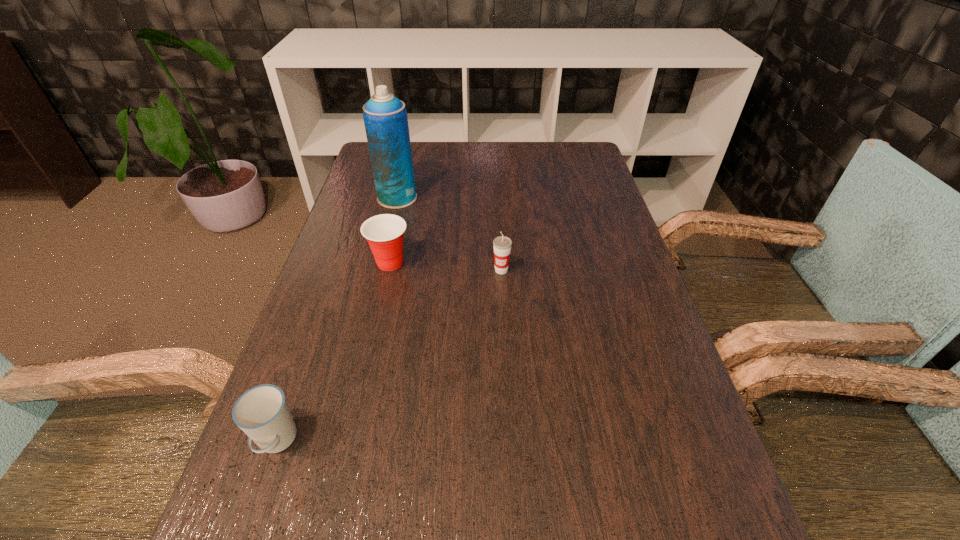
You are a GUI agent. You are given a task and a screenshot of the screen. Output one action in this format:
    pyautogui.click(x=<x>, y=<y>)
    Task: Click on the tallest object
    
    Given the screenshot: What is the action you would take?
    pyautogui.click(x=385, y=118)

Where is `the farthest object`? The image size is (960, 540). the farthest object is located at coordinates (385, 118).

Locate an element on the screen. the rightmost cup is located at coordinates (502, 245).

Where is `the second cup from right to left`? Image resolution: width=960 pixels, height=540 pixels. the second cup from right to left is located at coordinates (384, 233).

This screenshot has height=540, width=960. What are the coordinates of `the nearest object` in the screenshot? It's located at (262, 413).

Where is `the nearest cup`? the nearest cup is located at coordinates (262, 413).

Image resolution: width=960 pixels, height=540 pixels. What are the coordinates of `blank space located on the front of the farthest object` in the screenshot? It's located at (375, 285).

At what (x,y) coordinates should I click in order to perform the action: click on blank area located on the side of the rightmost object with the logo. Please return your answer as a coordinate pair (x, y). The height and width of the screenshot is (540, 960). Looking at the image, I should click on (505, 331).

Where is `vacant space situated 0.310m on the front of the second cup from right to left`? This screenshot has width=960, height=540. vacant space situated 0.310m on the front of the second cup from right to left is located at coordinates (361, 389).

Locate an element on the screen. free space located 0.060m with a handle on the side of the nearest object is located at coordinates (253, 507).